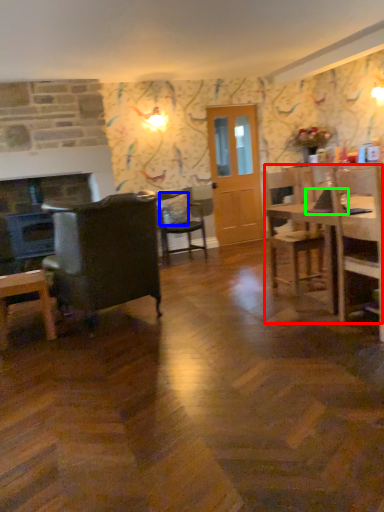
Question: Which object is the closest to the kitchen & dining room table (highlighted by a red box)? Choose among these: pillow (highlighted by a blue box) or laptop (highlighted by a green box).

Choices:
 (A) pillow
 (B) laptop

Answer: (B)